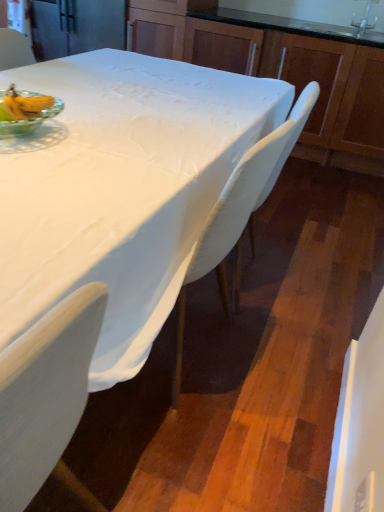
Question: From a real-world perspective, is white plastic chair at upper left, the 1th chair viewed from the back, physically below satin nickel faucet at upper right?

Choices:
 (A) no
 (B) yes

Answer: (B)

Question: Is white plastic chair at upper left, the 1th chair viewed from the back, bigger than satin nickel faucet at upper right?

Choices:
 (A) yes
 (B) no

Answer: (A)

Question: Are white plastic chair at upper left, arranged as the 2th chair when ordered from the bottom, and satin nickel faucet at upper right located far from each other?

Choices:
 (A) yes
 (B) no

Answer: (A)

Question: Is white plastic chair at upper left, the second chair from the right, outside of satin nickel faucet at upper right?

Choices:
 (A) yes
 (B) no

Answer: (A)

Question: Can you confirm if white plastic chair at upper left, the 2th chair from the front, is positioned to the left of satin nickel faucet at upper right?

Choices:
 (A) no
 (B) yes

Answer: (B)

Question: In the image, is white plastic chair at center, the 1th chair from the bottom, positioned in front of or behind white plastic chair at upper left, arranged as the 2th chair when ordered from the bottom?

Choices:
 (A) behind
 (B) front

Answer: (B)

Question: From the image's perspective, is white plastic chair at center, the 1th chair in the right-to-left sequence, located above or below white plastic chair at upper left, the 2th chair from the front?

Choices:
 (A) above
 (B) below

Answer: (B)

Question: Is white plastic chair at center, the 1th chair in the right-to-left sequence, wider or thinner than white plastic chair at upper left, the second chair from the right?

Choices:
 (A) thin
 (B) wide

Answer: (B)

Question: From their relative heights in the image, would you say white plastic chair at center, which is the second chair from left to right, is taller or shorter than white plastic chair at upper left, the 1th chair viewed from the back?

Choices:
 (A) tall
 (B) short

Answer: (A)

Question: Considering the positions of wooden cabinets at upper center and satin nickel faucet at upper right in the image, is wooden cabinets at upper center bigger or smaller than satin nickel faucet at upper right?

Choices:
 (A) small
 (B) big

Answer: (B)

Question: From the image's perspective, relative to satin nickel faucet at upper right, is wooden cabinets at upper center above or below?

Choices:
 (A) below
 (B) above

Answer: (A)

Question: Does point (324, 158) appear closer or farther from the camera than point (362, 19)?

Choices:
 (A) closer
 (B) farther

Answer: (B)

Question: Visually, is wooden cabinets at upper center positioned to the left or to the right of satin nickel faucet at upper right?

Choices:
 (A) left
 (B) right

Answer: (A)

Question: Is white plastic chair at center, which is the second chair from left to right, in front of or behind green glass bowl at upper left in the image?

Choices:
 (A) front
 (B) behind

Answer: (B)

Question: Is white plastic chair at center, which is the 2th chair from back to front, to the left or to the right of green glass bowl at upper left in the image?

Choices:
 (A) left
 (B) right

Answer: (B)